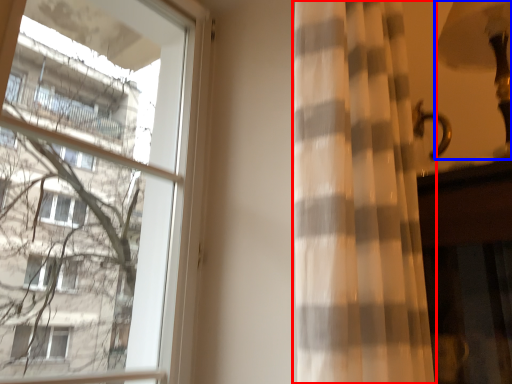
Question: Which of the following is the closest to the observer, curtain (highlighted by a red box) or table lamp (highlighted by a blue box)?

Choices:
 (A) curtain
 (B) table lamp

Answer: (A)